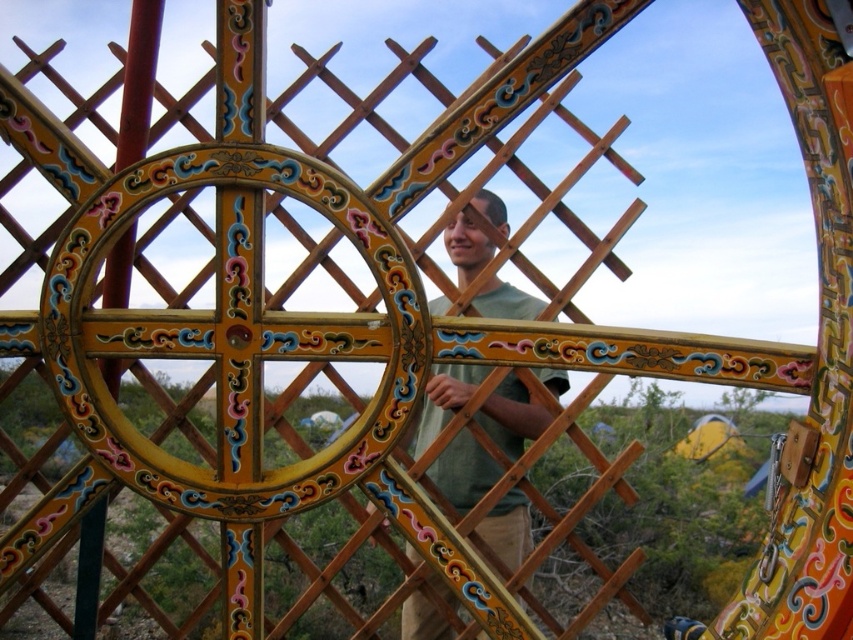
How distant is wooden lattice at center from green matte shirt at center?

A distance of 12.66 meters exists between wooden lattice at center and green matte shirt at center.

Is point (436, 352) closer to camera compared to point (460, 481)?

Yes, point (436, 352) is in front of point (460, 481).

Is point (117, 237) farther from viewer compared to point (463, 380)?

No, (117, 237) is in front of (463, 380).

Locate an element on the screen. wooden lattice at center is located at coordinates (268, 316).